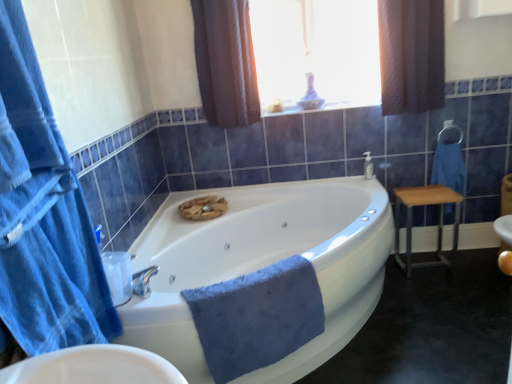
I want to click on free space in front of wooden/metallic stool at right, so click(x=444, y=288).